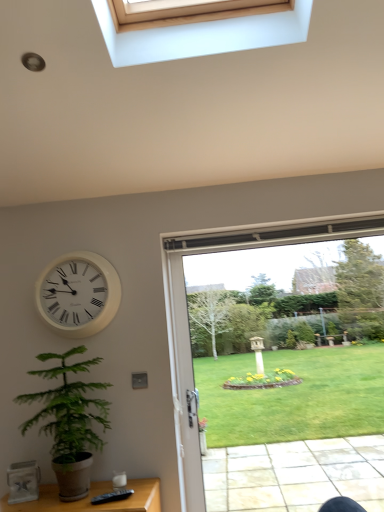
Question: From the image's perspective, is clear glass door at center above or below green leafy plant at lower left?

Choices:
 (A) below
 (B) above

Answer: (B)

Question: In the image, is clear glass door at center positioned in front of or behind green leafy plant at lower left?

Choices:
 (A) front
 (B) behind

Answer: (B)

Question: Which of these objects is positioned farthest from the green leafy plant at lower left?

Choices:
 (A) white plastic clock at upper left
 (B) clear glass door at center

Answer: (B)

Question: Estimate the real-world distances between objects in this image. Which object is farther from the clear glass door at center?

Choices:
 (A) green leafy plant at lower left
 (B) white plastic clock at upper left

Answer: (A)